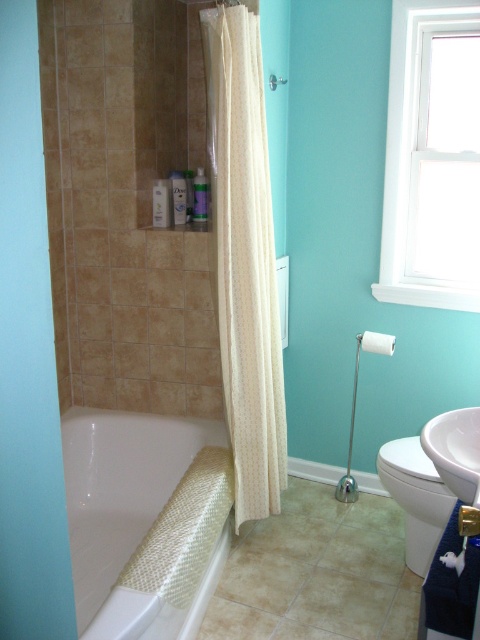
Is white glass window at upper right to the left of white matte towel bar at upper right from the viewer's perspective?

No, white glass window at upper right is not to the left of white matte towel bar at upper right.

Is point (433, 22) behind point (373, 332)?

No, it is in front of (373, 332).

Locate an element on the screen. white glass window at upper right is located at coordinates (412, 157).

Can you confirm if white glossy sink at lower right is bigger than white matte towel bar at upper right?

Yes.

Is white glossy sink at lower right taller than white matte towel bar at upper right?

Indeed, white glossy sink at lower right has a greater height compared to white matte towel bar at upper right.

Who is more forward, (437, 460) or (379, 348)?

Point (437, 460) is in front.

I want to click on white glossy sink at lower right, so click(456, 451).

Who is more distant from viewer, [96,412] or [431,554]?

The point [96,412] is more distant.

Can you confirm if white woven mat at lower left is shorter than white glossy toilet bowl at lower right?

No, white woven mat at lower left is not shorter than white glossy toilet bowl at lower right.

Is point (223, 563) more distant than point (387, 484)?

Yes, point (223, 563) is behind point (387, 484).

Locate an element on the screen. This screenshot has height=640, width=480. white woven mat at lower left is located at coordinates (128, 515).